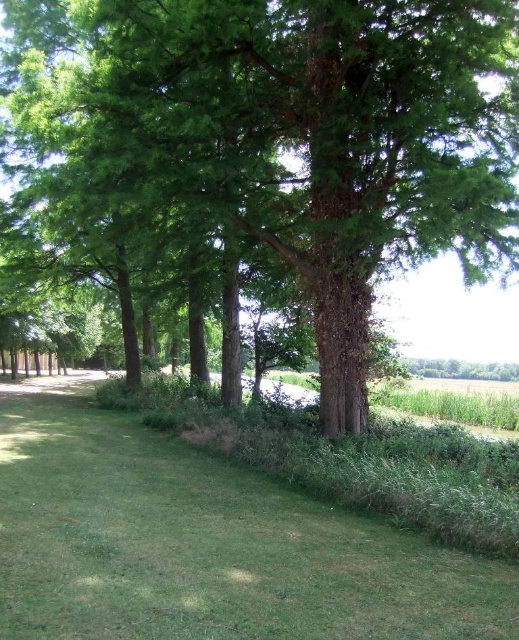
Is green rough bark tree at center above green grass at lower center?

Yes, green rough bark tree at center is above green grass at lower center.

Who is positioned more to the right, green rough bark tree at center or green grass at lower center?

Positioned to the right is green rough bark tree at center.

Does point (402, 61) lie in front of point (58, 387)?

Yes, point (402, 61) is closer to viewer.

Where is `green rough bark tree at center`? green rough bark tree at center is located at coordinates (312, 132).